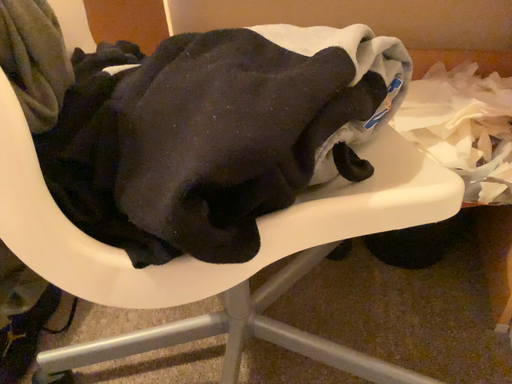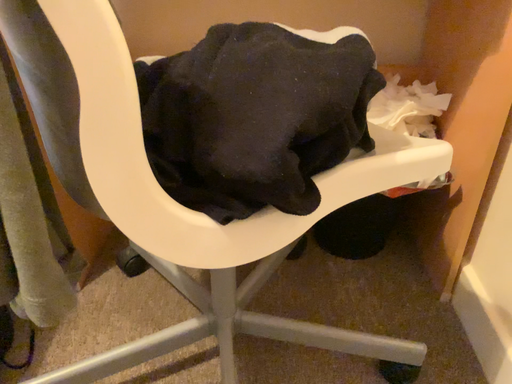
Question: How did the camera likely rotate when shooting the video?

Choices:
 (A) rotated left
 (B) rotated right

Answer: (B)